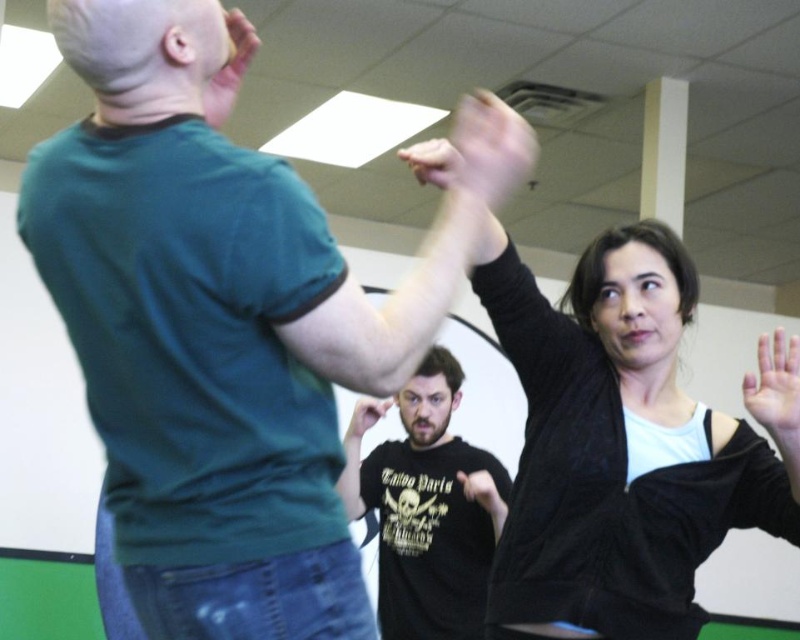
Question: Among these objects, which one is farthest from the camera?

Choices:
 (A) matte black t-shirt at center
 (B) matte black hand at center

Answer: (B)

Question: Does black matte arm at upper center lie behind matte black t-shirt at center?

Choices:
 (A) yes
 (B) no

Answer: (B)

Question: Which point is closer to the camera taking this photo?

Choices:
 (A) (466, 616)
 (B) (94, 68)
 (C) (366, 403)
 (D) (480, 502)

Answer: (B)

Question: Where is black matte arm at upper center located in relation to matte black hand at center in the image?

Choices:
 (A) above
 (B) below

Answer: (A)

Question: Which point is closer to the camera taking this photo?

Choices:
 (A) [x=533, y=157]
 (B) [x=352, y=420]

Answer: (B)

Question: Can you confirm if black matte arm at upper center is positioned to the right of matte black hand at center?

Choices:
 (A) yes
 (B) no

Answer: (A)